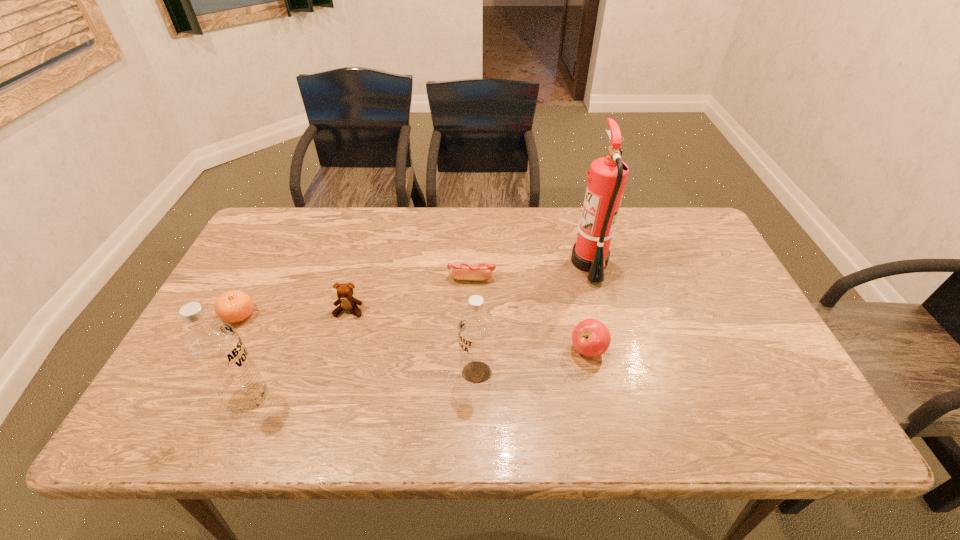
Where is `vacant area at the near right corner`? The width and height of the screenshot is (960, 540). vacant area at the near right corner is located at coordinates (720, 377).

Locate an element on the screen. The width and height of the screenshot is (960, 540). empty space that is in between the second shortest object and the apple is located at coordinates (414, 333).

In order to click on free area in between the fire extinguisher and the sausage in this screenshot , I will do `click(531, 270)`.

Locate an element on the screen. This screenshot has width=960, height=540. free space that is in between the shorter vodka and the apple is located at coordinates (533, 361).

In order to click on free space between the apple and the fifth shortest object in this screenshot , I will do `click(533, 361)`.

The width and height of the screenshot is (960, 540). I want to click on free space between the teddy bear and the sausage, so click(x=410, y=294).

Identify the location of vacant space in between the shortest object and the third object from left to right. The image size is (960, 540). (410, 294).

At what (x,y) coordinates should I click in order to perform the action: click on free point between the shortest object and the leftmost object. Please return your answer as a coordinate pair (x, y). This screenshot has width=960, height=540. Looking at the image, I should click on (355, 296).

This screenshot has height=540, width=960. Identify the location of free area in between the sausage and the apple. (530, 314).

You are a GUI agent. You are given a task and a screenshot of the screen. Output one action in this format:
    pyautogui.click(x=<x>, y=<y>)
    Task: Click on the vacant space that is in between the shorter vodka and the apple
    
    Given the screenshot: What is the action you would take?
    pyautogui.click(x=533, y=361)